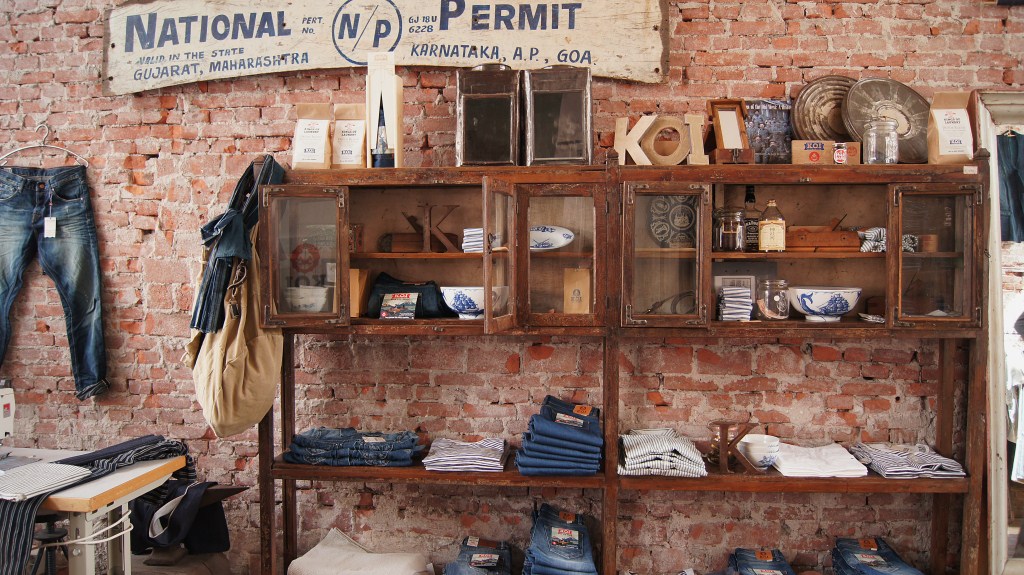
Image resolution: width=1024 pixels, height=575 pixels. In order to click on bowl in this screenshot , I will do `click(822, 301)`, `click(464, 300)`.